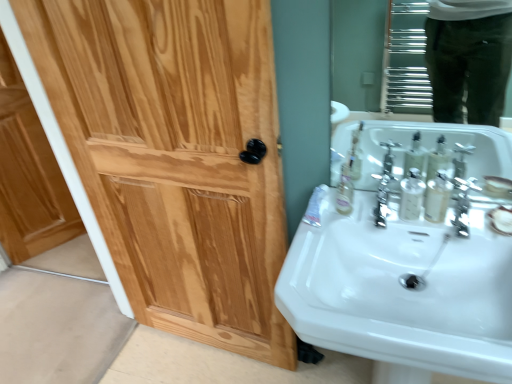
Question: Is light brown wood door at left located within white glossy sink at lower right?

Choices:
 (A) yes
 (B) no

Answer: (B)

Question: Is white glossy sink at lower right bigger than light brown wood door at left?

Choices:
 (A) yes
 (B) no

Answer: (A)

Question: From a real-world perspective, is white glossy sink at lower right on light brown wood door at left?

Choices:
 (A) yes
 (B) no

Answer: (A)

Question: Does white glossy sink at lower right have a lesser height compared to light brown wood door at left?

Choices:
 (A) no
 (B) yes

Answer: (B)

Question: Is the depth of white glossy sink at lower right greater than that of light brown wood door at left?

Choices:
 (A) yes
 (B) no

Answer: (B)

Question: Does white glossy sink at lower right appear on the right side of light brown wood door at left?

Choices:
 (A) yes
 (B) no

Answer: (A)

Question: Can you confirm if satin nickel faucet at right is smaller than translucent plastic mouthwash at sink right, the first mouthwash positioned from the right?

Choices:
 (A) yes
 (B) no

Answer: (B)

Question: Can we say satin nickel faucet at right lies outside translucent plastic mouthwash at sink right, the first mouthwash positioned from the right?

Choices:
 (A) yes
 (B) no

Answer: (A)

Question: Can you confirm if satin nickel faucet at right is bigger than translucent plastic mouthwash at sink right, the first mouthwash positioned from the right?

Choices:
 (A) yes
 (B) no

Answer: (A)

Question: From the image's perspective, would you say satin nickel faucet at right is shown under translucent plastic mouthwash at sink right, which ranks as the 2th mouthwash in left-to-right order?

Choices:
 (A) no
 (B) yes

Answer: (B)

Question: Is satin nickel faucet at right closer to the viewer compared to translucent plastic mouthwash at sink right, which ranks as the 2th mouthwash in left-to-right order?

Choices:
 (A) no
 (B) yes

Answer: (B)

Question: Can you confirm if satin nickel faucet at right is taller than translucent plastic mouthwash at sink right, the first mouthwash positioned from the right?

Choices:
 (A) yes
 (B) no

Answer: (B)

Question: Is glossy chrome mirror at upper right beside polished chrome faucet at center?

Choices:
 (A) yes
 (B) no

Answer: (B)